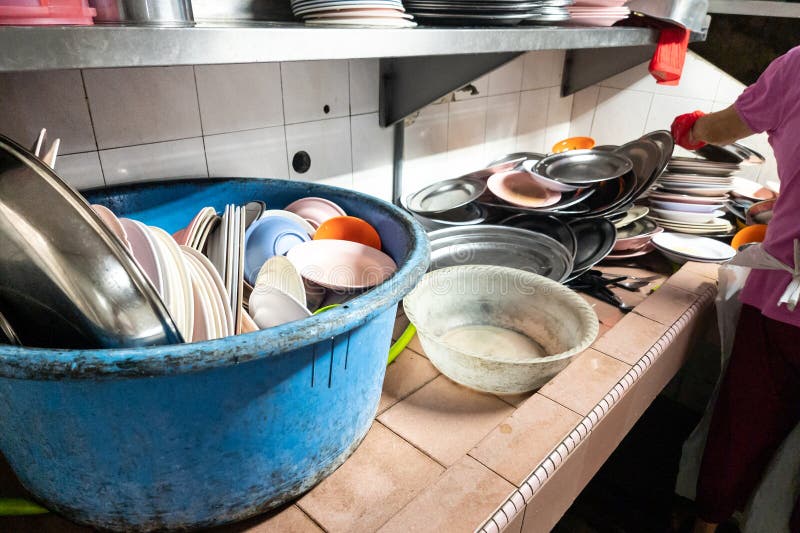
This screenshot has height=533, width=800. In order to click on clean dishes in this screenshot , I will do `click(505, 4)`, `click(600, 16)`, `click(552, 10)`, `click(370, 15)`.